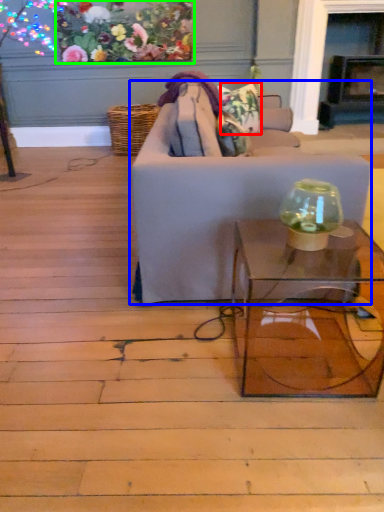
Question: Based on their relative distances, which object is nearer to flower (highlighted by a red box)? Choose from studio couch (highlighted by a blue box) and floral arrangement (highlighted by a green box).

Choices:
 (A) studio couch
 (B) floral arrangement

Answer: (A)